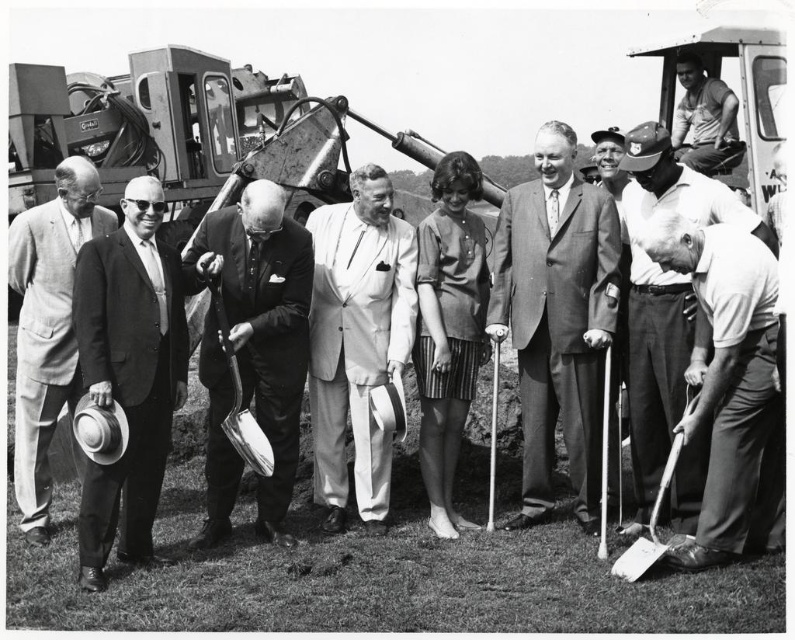
You are a photographer standing at the camera position. You want to take a closeup shot of the smooth suit at center. Considering the distance, do you think you can focus on it clearly?

The smooth suit at center is 165.27 feet away from the camera, so it is possible to focus on it clearly as long as the camera has sufficient zoom capability.

From the picture: Based on the scene described, which individual is positioned higher in the image between the smooth suit at center and the light gray suit at left?

The smooth suit at center is positioned higher than the light gray suit at left in the image.